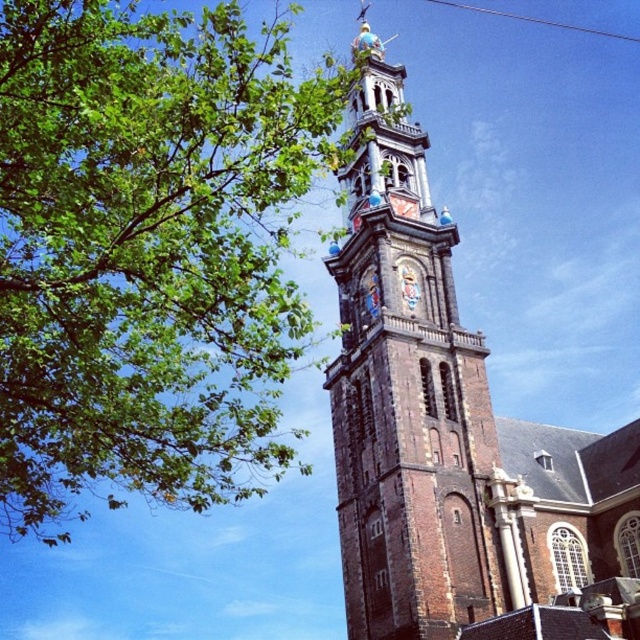
You are standing at the center of the image looking towards the church tower. Which direction should you move to get a clearer view of the tower without the obstruction of the green leafy tree at upper left?

Since the green leafy tree at upper left is located at point (148, 250), moving to the right would position you away from the tree, allowing a clearer view of the tower.

You are standing at the base of the historic church tower and want to take a photo that includes both the tower and the green leafy tree at upper left. Given that the tree is 31.86 meters away from your camera position, is it possible to capture both in a single frame without moving your position?

The green leafy tree at upper left is 31.86 meters away from the camera. Since the tree is positioned to the left of the tower and at a distance, it is possible to include both in the frame by adjusting the camera angle or using a wide enough lens to encompass both the tower and the tree without moving your position.

You are standing in a park and see the green leafy tree at upper left and the brown stone tower at center. Which object is closer to the left edge of the park?

The green leafy tree at upper left is positioned on the left side of brown stone tower at center, so it is closer to the left edge of the park.